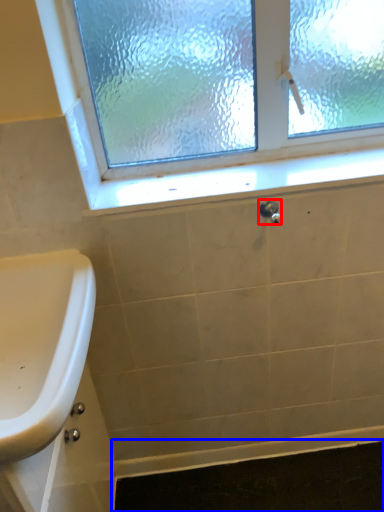
Question: Which of the following is the closest to the observer, plumbing fixture (highlighted by a red box) or bath mat (highlighted by a blue box)?

Choices:
 (A) plumbing fixture
 (B) bath mat

Answer: (A)